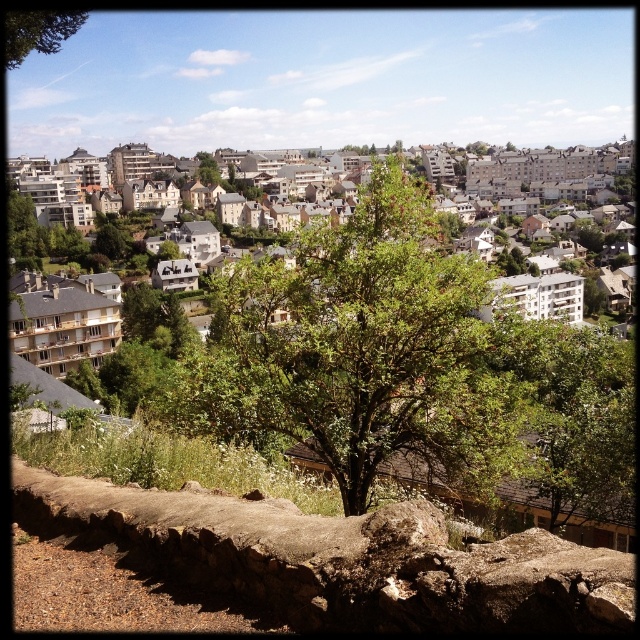
Which is more to the left, green leafy tree at center or green leafy tree at upper left?

From the viewer's perspective, green leafy tree at upper left appears more on the left side.

Between point (410, 435) and point (42, 26), which one is positioned behind?

Point (42, 26)

Is point (268, 381) farther from camera compared to point (19, 35)?

No, (268, 381) is closer to viewer.

Image resolution: width=640 pixels, height=640 pixels. Find the location of `green leafy tree at center`. green leafy tree at center is located at coordinates (362, 349).